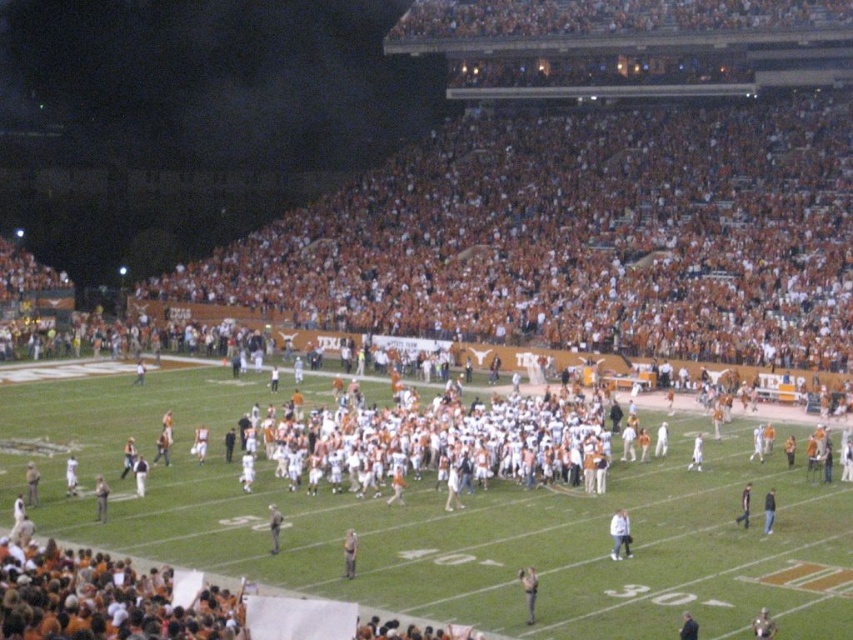
The height and width of the screenshot is (640, 853). What do you see at coordinates (527, 589) in the screenshot?
I see `white cotton shirt at center` at bounding box center [527, 589].

Is point (519, 577) less distant than point (270, 513)?

Yes, it is.

The height and width of the screenshot is (640, 853). I want to click on white cotton shirt at center, so click(x=527, y=589).

Who is more forward, (349, 550) or (698, 460)?

Point (349, 550)

Is light brown leather jacket at center bigger than white fabric person at center?

Correct, light brown leather jacket at center is larger in size than white fabric person at center.

Describe the element at coordinates (349, 554) in the screenshot. I see `light brown leather jacket at center` at that location.

This screenshot has height=640, width=853. Find the location of `light brown leather jacket at center`. light brown leather jacket at center is located at coordinates (349, 554).

Which is above, light brown leather jacket at lower left or white fabric person at center?

white fabric person at center

What do you see at coordinates (100, 497) in the screenshot?
I see `light brown leather jacket at lower left` at bounding box center [100, 497].

You are a GUI agent. You are given a task and a screenshot of the screen. Output one action in this format:
    pyautogui.click(x=<x>, y=<y>)
    Task: Click on the light brown leather jacket at lower left
    This screenshot has width=853, height=640.
    Given the screenshot: What is the action you would take?
    pyautogui.click(x=100, y=497)

At what (x,y) coordinates should I click in order to perform the action: click on light brown leather jacket at lower left. Please return your answer as a coordinate pair (x, y). Looking at the image, I should click on (100, 497).